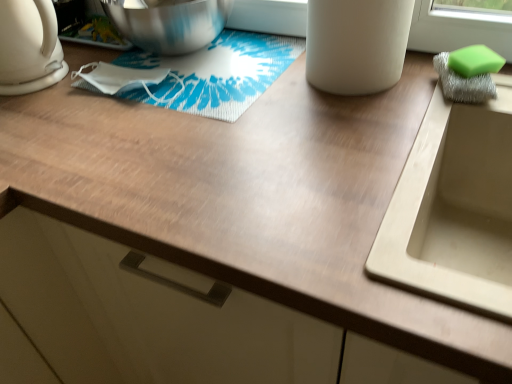
Find the location of a particular element. The image size is (512, 384). free region on the left part of white matte cup at upper center is located at coordinates (281, 93).